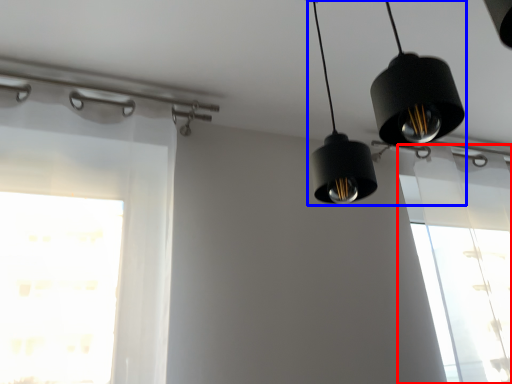
Question: Which point is further to the camera, window (highlighted by a red box) or lighting (highlighted by a blue box)?

Choices:
 (A) window
 (B) lighting

Answer: (A)